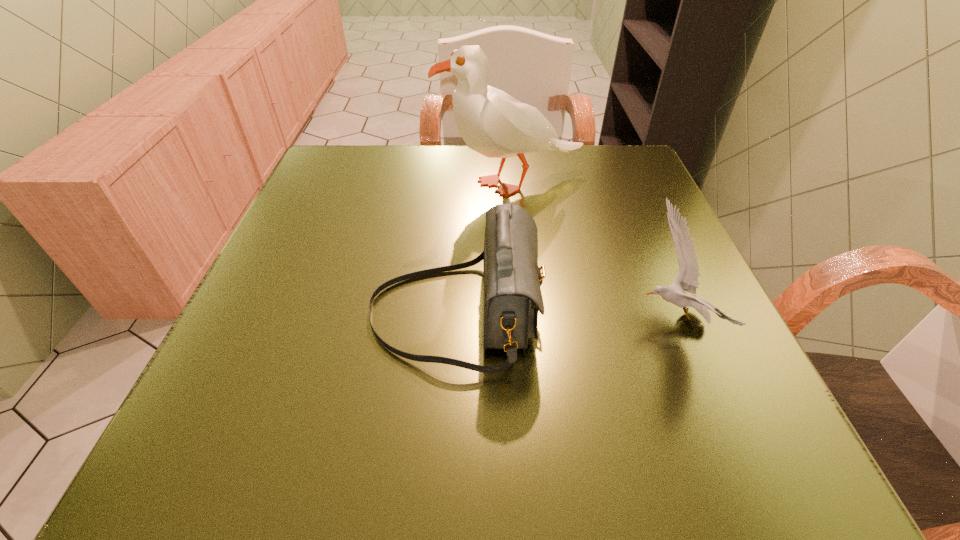
Find the location of `the tallest object`. the tallest object is located at coordinates (491, 122).

This screenshot has height=540, width=960. I want to click on the farthest object, so click(x=491, y=122).

Where is `the second tallest object`? the second tallest object is located at coordinates (512, 279).

Find the location of `the shortest object`. the shortest object is located at coordinates pos(687,279).

Image resolution: width=960 pixels, height=540 pixels. In order to click on the nearer gull in this screenshot , I will do `click(687, 279)`.

Where is `free region located at the beak of the farther gull`? The height and width of the screenshot is (540, 960). free region located at the beak of the farther gull is located at coordinates (333, 184).

In order to click on vacant area located 0.110m at the beak of the farther gull in this screenshot , I will do tap(391, 184).

Locate an element on the screen. vacant space located at the beak of the farther gull is located at coordinates (364, 184).

Locate an element on the screen. The height and width of the screenshot is (540, 960). vacant space situated on the left of the second shortest object is located at coordinates (276, 312).

You are a GUI agent. You are given a task and a screenshot of the screen. Output one action in this format:
    pyautogui.click(x=<x>, y=<y>)
    Task: Click on the vacant space located at the tip of the beak of the shortest object
    
    Given the screenshot: What is the action you would take?
    pyautogui.click(x=457, y=318)